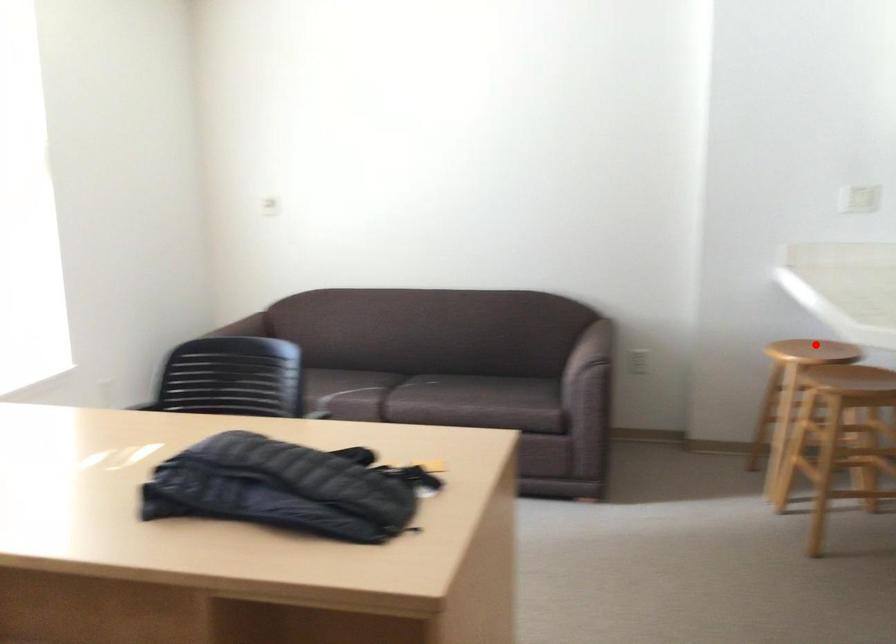
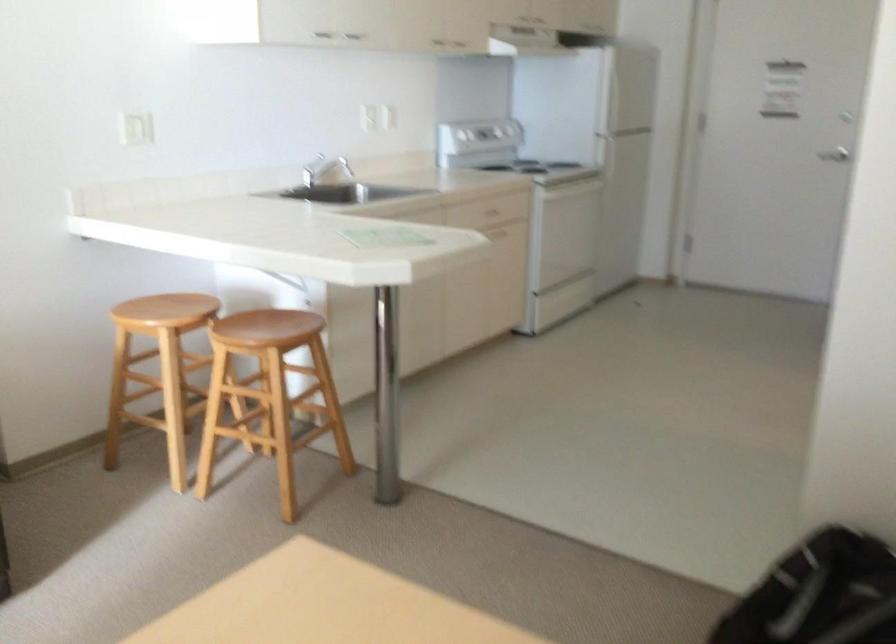
Question: I am providing you with two images of the same scene from different viewpoints. Given a red point in image1, look at the same physical point in image2. Is it:

Choices:
 (A) Closer to the viewpoint
 (B) Farther from the viewpoint

Answer: (A)